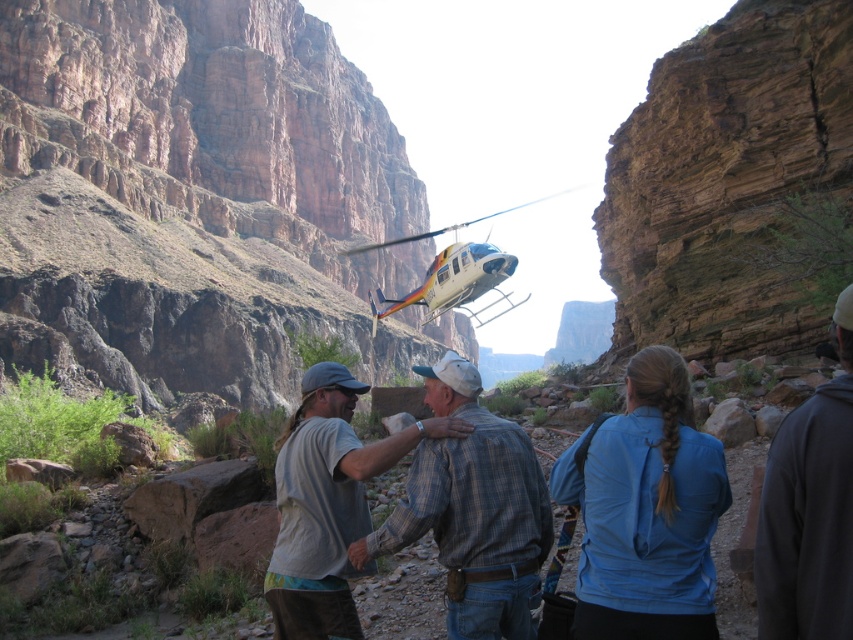
Question: Estimate the real-world distances between objects in this image. Which object is closer to the blue fabric jacket at center?

Choices:
 (A) plaid fabric shirt at center
 (B) white plastic helicopter at center
 (C) dark gray hoodie at lower right

Answer: (C)

Question: Is dark gray hoodie at lower right wider than white plastic helicopter at center?

Choices:
 (A) no
 (B) yes

Answer: (A)

Question: Does plaid fabric shirt at center appear on the right side of light gray cotton shirt at center?

Choices:
 (A) no
 (B) yes

Answer: (B)

Question: Based on their relative distances, which object is farther from the plaid fabric shirt at center?

Choices:
 (A) dark gray hoodie at lower right
 (B) white plastic helicopter at center

Answer: (B)

Question: Is plaid fabric shirt at center further to the viewer compared to dark gray hoodie at lower right?

Choices:
 (A) yes
 (B) no

Answer: (A)

Question: Which object appears closest to the camera in this image?

Choices:
 (A) plaid fabric shirt at center
 (B) white plastic helicopter at center
 (C) dark gray hoodie at lower right

Answer: (C)